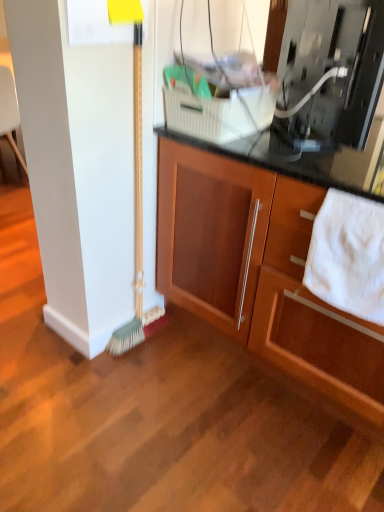
Question: Does wooden cabinet at center have a lesser height compared to metallic silver microwave at upper right?

Choices:
 (A) yes
 (B) no

Answer: (B)

Question: Is wooden cabinet at center beside metallic silver microwave at upper right?

Choices:
 (A) yes
 (B) no

Answer: (B)

Question: From the image's perspective, is wooden cabinet at center beneath metallic silver microwave at upper right?

Choices:
 (A) no
 (B) yes

Answer: (B)

Question: Is wooden cabinet at center far from metallic silver microwave at upper right?

Choices:
 (A) yes
 (B) no

Answer: (B)

Question: Would you say wooden cabinet at center contains metallic silver microwave at upper right?

Choices:
 (A) yes
 (B) no

Answer: (B)

Question: Is green bristle broom at left inside or outside of metallic silver microwave at upper right?

Choices:
 (A) outside
 (B) inside

Answer: (A)

Question: In terms of height, does green bristle broom at left look taller or shorter compared to metallic silver microwave at upper right?

Choices:
 (A) short
 (B) tall

Answer: (B)

Question: In the image, is green bristle broom at left positioned in front of or behind metallic silver microwave at upper right?

Choices:
 (A) behind
 (B) front

Answer: (A)

Question: Is green bristle broom at left to the left or to the right of metallic silver microwave at upper right in the image?

Choices:
 (A) right
 (B) left

Answer: (B)

Question: In terms of size, does metallic silver microwave at upper right appear bigger or smaller than white soft towel at lower right?

Choices:
 (A) big
 (B) small

Answer: (A)

Question: Is point (334, 12) closer or farther from the camera than point (312, 260)?

Choices:
 (A) closer
 (B) farther

Answer: (B)

Question: From the image's perspective, is metallic silver microwave at upper right above or below white soft towel at lower right?

Choices:
 (A) above
 (B) below

Answer: (A)

Question: In terms of width, does metallic silver microwave at upper right look wider or thinner when compared to white soft towel at lower right?

Choices:
 (A) thin
 (B) wide

Answer: (B)

Question: Do you think metallic silver microwave at upper right is within green bristle broom at left, or outside of it?

Choices:
 (A) outside
 (B) inside

Answer: (A)

Question: In the image, is metallic silver microwave at upper right on the left side or the right side of green bristle broom at left?

Choices:
 (A) right
 (B) left

Answer: (A)